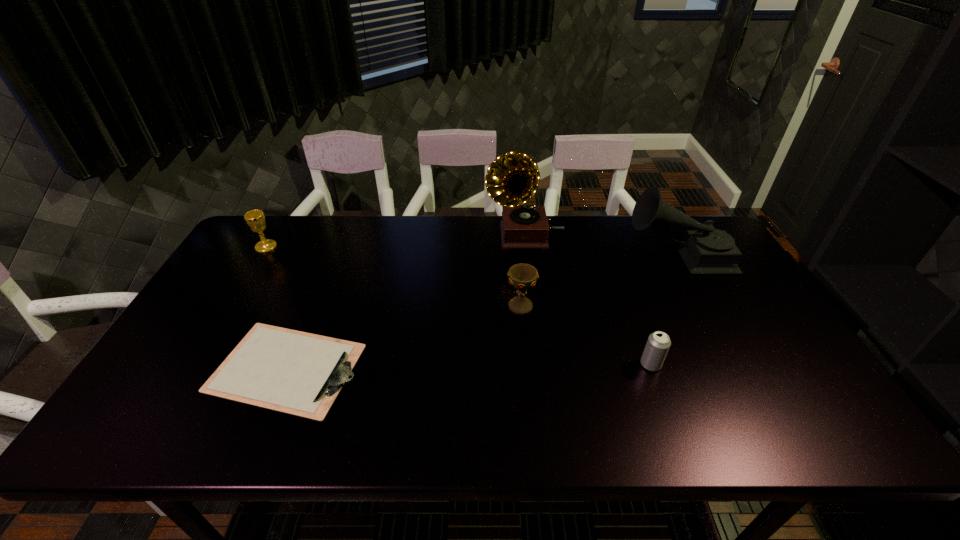
This screenshot has width=960, height=540. What are the coordinates of `vacant area that lies between the shorter phonograph_record and the taller phonograph_record` in the screenshot? It's located at (601, 245).

Find the location of a particular element. unoccupied area between the third nearest object and the fifth object from right to left is located at coordinates [403, 338].

The width and height of the screenshot is (960, 540). Find the location of `vacant area that lies between the second shortest object and the right chalice`. vacant area that lies between the second shortest object and the right chalice is located at coordinates (586, 335).

Image resolution: width=960 pixels, height=540 pixels. I want to click on vacant area that lies between the second object from right to left and the rightmost object, so click(664, 310).

The height and width of the screenshot is (540, 960). I want to click on object that stands as the second closest to the second object from right to left, so click(x=705, y=250).

This screenshot has width=960, height=540. I want to click on object that stands as the fifth closest to the right phonograph_record, so click(x=255, y=219).

Identify the location of vacant position in the image that satisfies the following two spatial constraints: 1. from the horn of the tallest object; 2. on the front side of the clipboard. Image resolution: width=960 pixels, height=540 pixels. [x=540, y=368].

Identify the location of free space that satisfies the following two spatial constraints: 1. from the horn of the tallest object; 2. on the left side of the second shortest object. (540, 364).